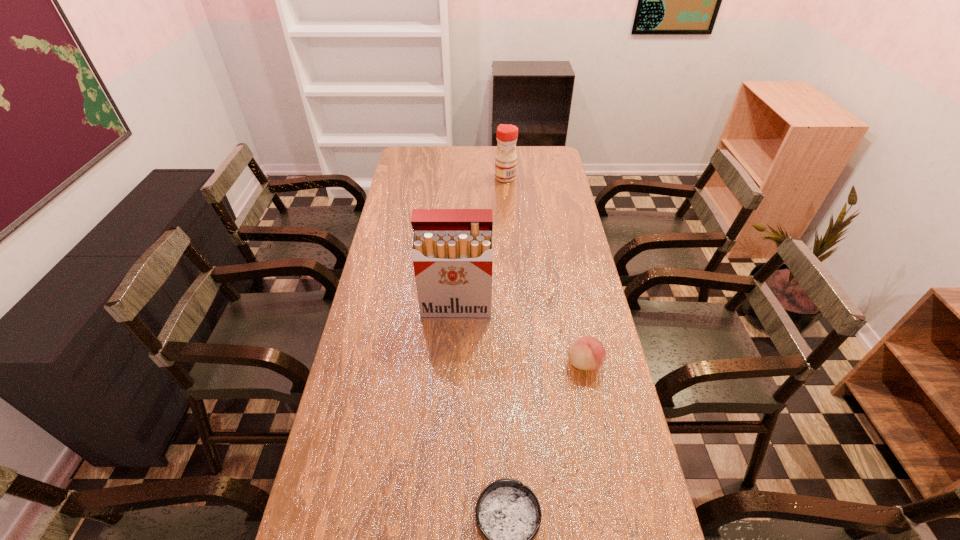
Locate an element on the screen. The width and height of the screenshot is (960, 540). the tallest object is located at coordinates (452, 248).

Where is `the second farthest object`? The width and height of the screenshot is (960, 540). the second farthest object is located at coordinates (452, 248).

The width and height of the screenshot is (960, 540). In order to click on condiment in this screenshot , I will do `click(505, 163)`.

I want to click on the third shortest object, so click(x=505, y=163).

Locate an element on the screen. the rightmost object is located at coordinates (587, 353).

Where is `peach`? This screenshot has width=960, height=540. peach is located at coordinates (587, 353).

Identify the location of free space located with the lid open on the cigarette case. The width and height of the screenshot is (960, 540). (455, 343).

Identify the location of free space located on the right of the farthest object. (564, 178).

Where is `vacant region located 0.240m on the back of the rightmost object`? This screenshot has width=960, height=540. vacant region located 0.240m on the back of the rightmost object is located at coordinates (569, 291).

What are the coordinates of `object that is positioned at the far edge` in the screenshot? It's located at (505, 163).